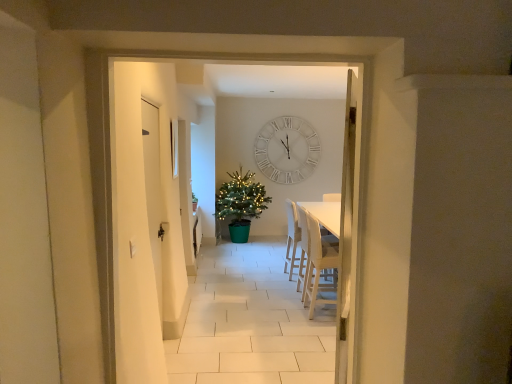
Question: In which direction should I rotate to look at white fabric chair at center, which is counted as the first armchair, starting from the back?

Choices:
 (A) right
 (B) left

Answer: (A)

Question: From a real-world perspective, is green plastic christmas tree at center below white matte door at left?

Choices:
 (A) no
 (B) yes

Answer: (B)

Question: Can you confirm if green plastic christmas tree at center is bigger than white matte door at left?

Choices:
 (A) yes
 (B) no

Answer: (A)

Question: Can you see green plastic christmas tree at center touching white matte door at left?

Choices:
 (A) no
 (B) yes

Answer: (A)

Question: Is green plastic christmas tree at center smaller than white matte door at left?

Choices:
 (A) yes
 (B) no

Answer: (B)

Question: From a real-world perspective, does green plastic christmas tree at center stand above white matte door at left?

Choices:
 (A) no
 (B) yes

Answer: (A)

Question: Does green plastic christmas tree at center contain white matte door at left?

Choices:
 (A) yes
 (B) no

Answer: (B)

Question: Does white fabric chair at center, which is counted as the first armchair, starting from the back, turn towards white matte wall clock at center?

Choices:
 (A) no
 (B) yes

Answer: (A)

Question: Can you confirm if white fabric chair at center, which is counted as the first armchair, starting from the back, is bigger than white matte wall clock at center?

Choices:
 (A) no
 (B) yes

Answer: (B)

Question: Is white fabric chair at center, which is counted as the first armchair, starting from the back, wider than white matte wall clock at center?

Choices:
 (A) no
 (B) yes

Answer: (B)

Question: From a real-world perspective, is white fabric chair at center, placed as the 2th armchair when sorted from front to back, positioned under white matte wall clock at center based on gravity?

Choices:
 (A) no
 (B) yes

Answer: (B)

Question: Is the position of white fabric chair at center, placed as the 2th armchair when sorted from front to back, less distant than that of white matte wall clock at center?

Choices:
 (A) yes
 (B) no

Answer: (A)

Question: Does white fabric chair at center, which is counted as the first armchair, starting from the back, appear on the left side of white matte wall clock at center?

Choices:
 (A) no
 (B) yes

Answer: (A)

Question: Does light beige fabric armchair at right, the 1th armchair positioned from the front, come in front of white matte wall clock at center?

Choices:
 (A) no
 (B) yes

Answer: (B)